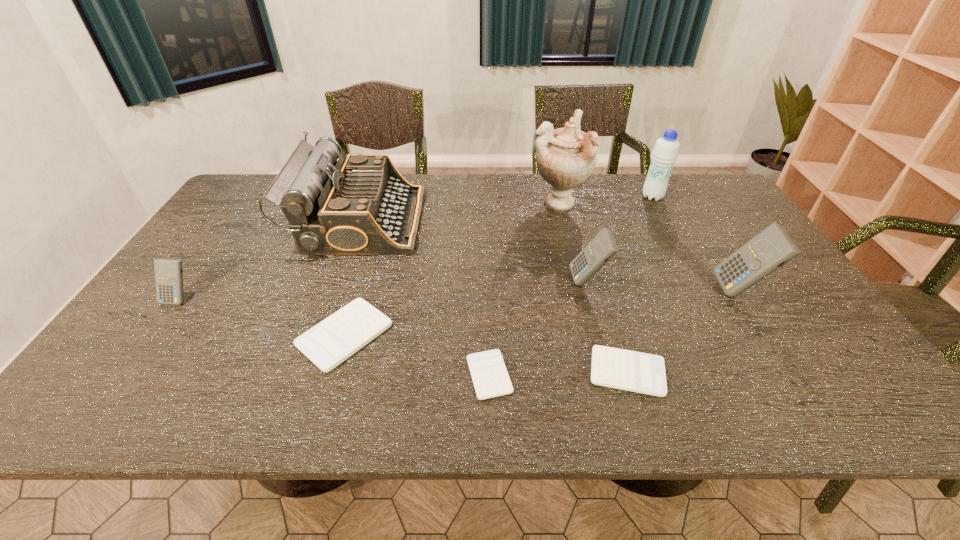
Locate an element on the screen. free location that satisfies the following two spatial constraints: 1. on the keyboard of the typewriter; 2. on the right side of the seventh tallest object is located at coordinates (320, 335).

You are a GUI agent. You are given a task and a screenshot of the screen. Output one action in this format:
    pyautogui.click(x=<x>, y=<y>)
    Task: Click on the vacant space that satisfies the following two spatial constraints: 1. on the keyboard of the typewriter; 2. on the front-facing side of the leftmost calculator
    
    Given the screenshot: What is the action you would take?
    pyautogui.click(x=333, y=299)